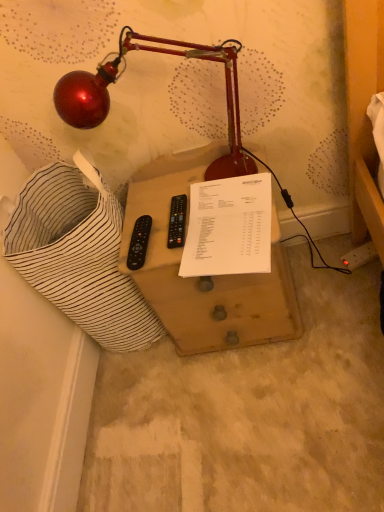
The image size is (384, 512). Find the location of `spots to the right of black plastic remote at center-left, the first control in the left-to-right sequence`. spots to the right of black plastic remote at center-left, the first control in the left-to-right sequence is located at coordinates (196, 224).